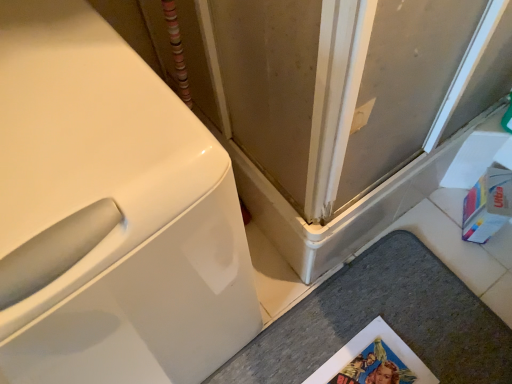
Image resolution: width=512 pixels, height=384 pixels. In order to click on white glossy washing machine at left in this screenshot , I will do `click(110, 213)`.

What is the approximate height of white glossy washing machine at left?

white glossy washing machine at left is 35.15 inches in height.

Image resolution: width=512 pixels, height=384 pixels. Describe the element at coordinates (110, 213) in the screenshot. I see `white glossy washing machine at left` at that location.

Describe the element at coordinates (384, 319) in the screenshot. This screenshot has width=512, height=384. I see `gray carpet at lower center` at that location.

Identify the location of gray carpet at lower center. This screenshot has width=512, height=384. (384, 319).

Image resolution: width=512 pixels, height=384 pixels. Find the location of `white glossy washing machine at left`. white glossy washing machine at left is located at coordinates (110, 213).

Considering the positions of objects white glossy washing machine at left and gray carpet at lower center in the image provided, who is more to the left, white glossy washing machine at left or gray carpet at lower center?

From the viewer's perspective, white glossy washing machine at left appears more on the left side.

Between white glossy washing machine at left and gray carpet at lower center, which one is positioned behind?

gray carpet at lower center is more distant.

Is point (3, 207) closer or farther from the camera than point (330, 283)?

Point (3, 207) appears to be closer to the viewer than point (330, 283).

From the image's perspective, relative to gray carpet at lower center, is white glossy washing machine at left above or below?

Based on their image positions, white glossy washing machine at left is located above gray carpet at lower center.

From a real-world perspective, relative to gray carpet at lower center, is white glossy washing machine at left vertically above or below?

Clearly, from a real-world perspective, white glossy washing machine at left is above gray carpet at lower center.

Does white glossy washing machine at left have a lesser width compared to gray carpet at lower center?

No, white glossy washing machine at left is not thinner than gray carpet at lower center.

Is white glossy washing machine at left taller or shorter than gray carpet at lower center?

Considering their sizes, white glossy washing machine at left has more height than gray carpet at lower center.

Considering the relative sizes of white glossy washing machine at left and gray carpet at lower center in the image provided, is white glossy washing machine at left smaller than gray carpet at lower center?

Actually, white glossy washing machine at left might be larger than gray carpet at lower center.

Would you say white glossy washing machine at left contains gray carpet at lower center?

That's incorrect, gray carpet at lower center is not inside white glossy washing machine at left.

Would you consider white glossy washing machine at left to be distant from gray carpet at lower center?

No, white glossy washing machine at left is not far from gray carpet at lower center.

Based on the photo, does white glossy washing machine at left turn towards gray carpet at lower center?

No, white glossy washing machine at left is not turned towards gray carpet at lower center.

Based on the photo, measure the distance between white glossy washing machine at left and gray carpet at lower center.

white glossy washing machine at left is 25.59 inches away from gray carpet at lower center.

Locate an element on the screen. washing machine above the gray carpet at lower center (from a real-world perspective) is located at coordinates (110, 213).

Is gray carpet at lower center at the right side of white glossy washing machine at left?

Correct, you'll find gray carpet at lower center to the right of white glossy washing machine at left.

Considering the relative positions of gray carpet at lower center and white glossy washing machine at left in the image provided, is gray carpet at lower center behind white glossy washing machine at left?

Yes, the depth of gray carpet at lower center is greater than that of white glossy washing machine at left.

Is point (388, 294) positioned after point (142, 378)?

That is True.

Consider the image. From the image's perspective, is gray carpet at lower center positioned above or below white glossy washing machine at left?

gray carpet at lower center is below white glossy washing machine at left.

From a real-world perspective, is gray carpet at lower center above or below white glossy washing machine at left?

In terms of real-world spatial position, gray carpet at lower center is below white glossy washing machine at left.

Between gray carpet at lower center and white glossy washing machine at left, which one has larger width?

white glossy washing machine at left is wider.

Which of these two, gray carpet at lower center or white glossy washing machine at left, stands shorter?

gray carpet at lower center.

In terms of size, does gray carpet at lower center appear bigger or smaller than white glossy washing machine at left?

gray carpet at lower center is smaller than white glossy washing machine at left.

Is gray carpet at lower center spatially inside white glossy washing machine at left, or outside of it?

gray carpet at lower center is located beyond the bounds of white glossy washing machine at left.

Is gray carpet at lower center not near white glossy washing machine at left?

No, gray carpet at lower center is not far away from white glossy washing machine at left.

Could you tell me if gray carpet at lower center is facing white glossy washing machine at left?

No, gray carpet at lower center is not oriented towards white glossy washing machine at left.

What's the angular difference between gray carpet at lower center and white glossy washing machine at left's facing directions?

They differ by 5.22 degrees in their facing directions.

At what (x,y) coordinates should I click in order to perform the action: click on washing machine above the gray carpet at lower center (from the image's perspective). Please return your answer as a coordinate pair (x, y). Looking at the image, I should click on (110, 213).

Where is `washing machine above the gray carpet at lower center (from a real-world perspective)`? washing machine above the gray carpet at lower center (from a real-world perspective) is located at coordinates (x=110, y=213).

Where is `counter top lying behind the white glossy washing machine at left`? counter top lying behind the white glossy washing machine at left is located at coordinates (384, 319).